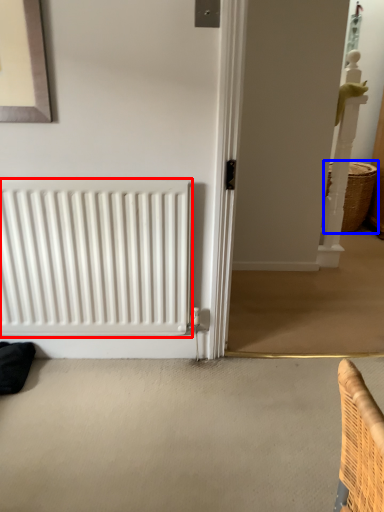
Question: Which object is further to the camera taking this photo, radiator (highlighted by a red box) or basket (highlighted by a blue box)?

Choices:
 (A) radiator
 (B) basket

Answer: (B)